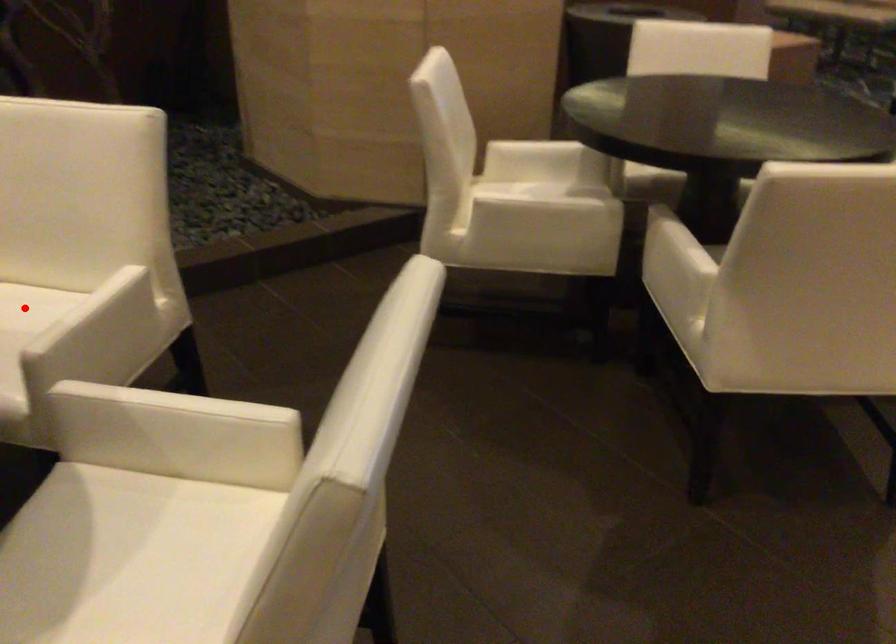
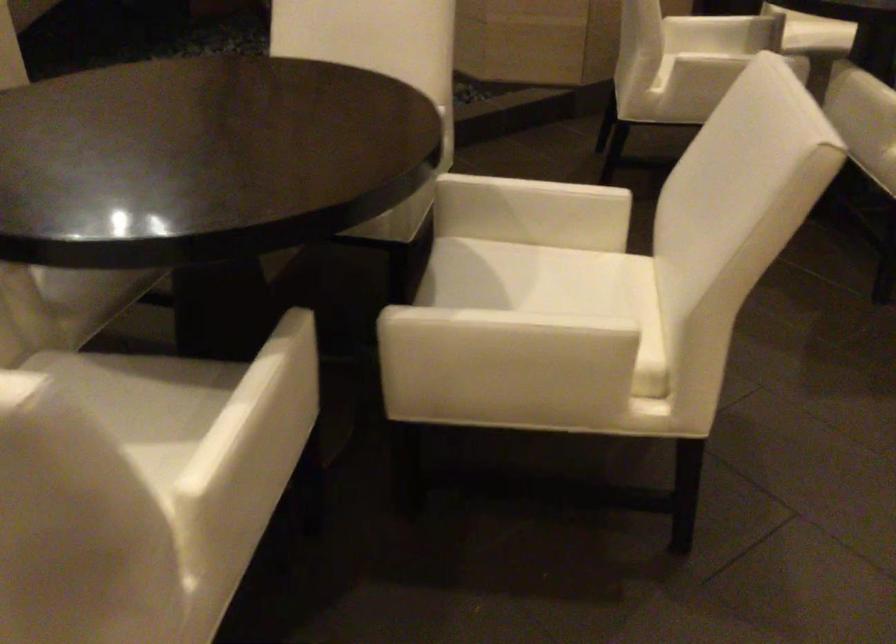
Question: I am providing you with two images of the same scene from different viewpoints. A red point is marked on the first image. Is the red point's position out of view in image 2?

Choices:
 (A) Yes
 (B) No

Answer: (A)